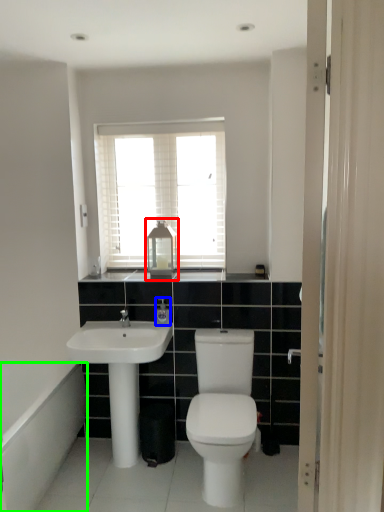
Question: Based on their relative distances, which object is nearer to medicine cabinet (highlighted by a red box)? Choose from toiletry (highlighted by a blue box) and bath (highlighted by a green box).

Choices:
 (A) toiletry
 (B) bath

Answer: (A)